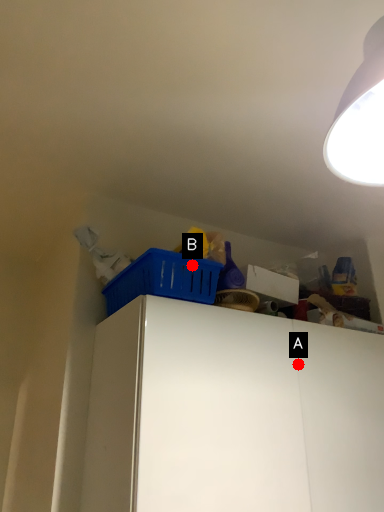
Question: Two points are circled on the image, labeled by A and B beside each circle. Which point is closer to the camera?

Choices:
 (A) A is closer
 (B) B is closer

Answer: (B)